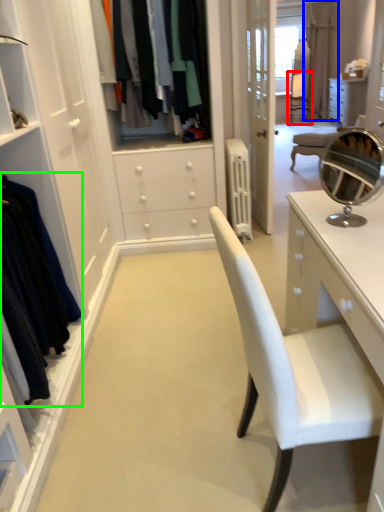
Question: Which object is the closest to the armchair (highlighted by a red box)? Choose among these: curtain (highlighted by a blue box) or clothing (highlighted by a green box).

Choices:
 (A) curtain
 (B) clothing

Answer: (A)